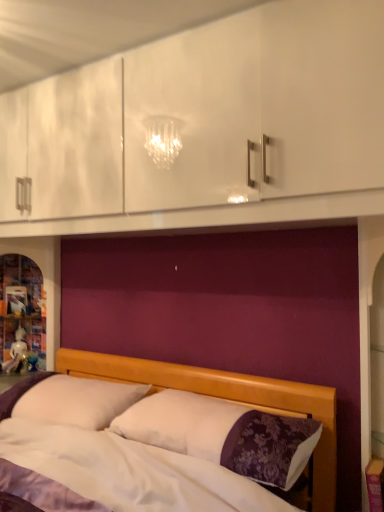
Question: Is the position of wooden bed at center less distant than that of white soft pillow at lower left?

Choices:
 (A) yes
 (B) no

Answer: (A)

Question: Can you confirm if wooden bed at center is smaller than white soft pillow at lower left?

Choices:
 (A) yes
 (B) no

Answer: (B)

Question: Considering the relative positions of wooden bed at center and white soft pillow at lower left in the image provided, is wooden bed at center behind white soft pillow at lower left?

Choices:
 (A) yes
 (B) no

Answer: (B)

Question: Is wooden bed at center outside of white soft pillow at lower left?

Choices:
 (A) no
 (B) yes

Answer: (B)

Question: From a real-world perspective, is wooden bed at center on white soft pillow at lower left?

Choices:
 (A) yes
 (B) no

Answer: (B)

Question: Does wooden bed at center appear on the left side of white soft pillow at lower left?

Choices:
 (A) yes
 (B) no

Answer: (B)

Question: Considering the relative positions of white soft pillow at lower left and wooden bed at center in the image provided, is white soft pillow at lower left to the right of wooden bed at center from the viewer's perspective?

Choices:
 (A) no
 (B) yes

Answer: (A)

Question: Is white soft pillow at lower left bigger than wooden bed at center?

Choices:
 (A) yes
 (B) no

Answer: (B)

Question: Are white soft pillow at lower left and wooden bed at center far apart?

Choices:
 (A) yes
 (B) no

Answer: (B)

Question: Is white soft pillow at lower left aimed at wooden bed at center?

Choices:
 (A) yes
 (B) no

Answer: (A)

Question: Would you say white soft pillow at lower left is outside wooden bed at center?

Choices:
 (A) no
 (B) yes

Answer: (A)

Question: Is wooden bed at center at the back of white soft pillow at lower left?

Choices:
 (A) yes
 (B) no

Answer: (A)

Question: Does point click(x=69, y=384) appear closer or farther from the camera than point click(x=238, y=387)?

Choices:
 (A) closer
 (B) farther

Answer: (B)